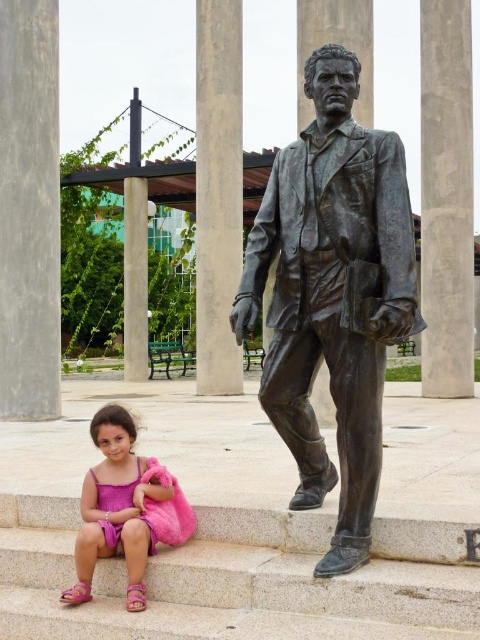
Does white stone stairs at lower left have a smaller size compared to pink fabric at lower left?

Yes, white stone stairs at lower left is smaller than pink fabric at lower left.

What do you see at coordinates (242, 579) in the screenshot? I see `white stone stairs at lower left` at bounding box center [242, 579].

The width and height of the screenshot is (480, 640). What do you see at coordinates (242, 579) in the screenshot?
I see `white stone stairs at lower left` at bounding box center [242, 579].

Find the location of `white stone stairs at lower left`. white stone stairs at lower left is located at coordinates (242, 579).

Between gray concrete pillar at left and smooth concrete pillar at right, which one is positioned higher?

smooth concrete pillar at right

Does point (43, 48) come farther from viewer compared to point (458, 252)?

That is False.

Locate an element on the screen. This screenshot has width=480, height=640. gray concrete pillar at left is located at coordinates (28, 211).

Find the location of `gray concrete pillar at left`. gray concrete pillar at left is located at coordinates (28, 211).

Does white stone stairs at lower left have a lesser height compared to gray concrete pillar at left?

Correct, white stone stairs at lower left is not as tall as gray concrete pillar at left.

At what (x,y) coordinates should I click in order to perform the action: click on white stone stairs at lower left. Please return your answer as a coordinate pair (x, y). The image size is (480, 640). Looking at the image, I should click on (242, 579).